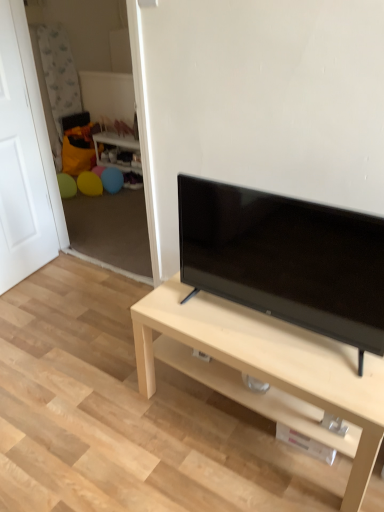
The width and height of the screenshot is (384, 512). In order to click on free spot in front of black glossy tv at center in this screenshot , I will do `click(298, 364)`.